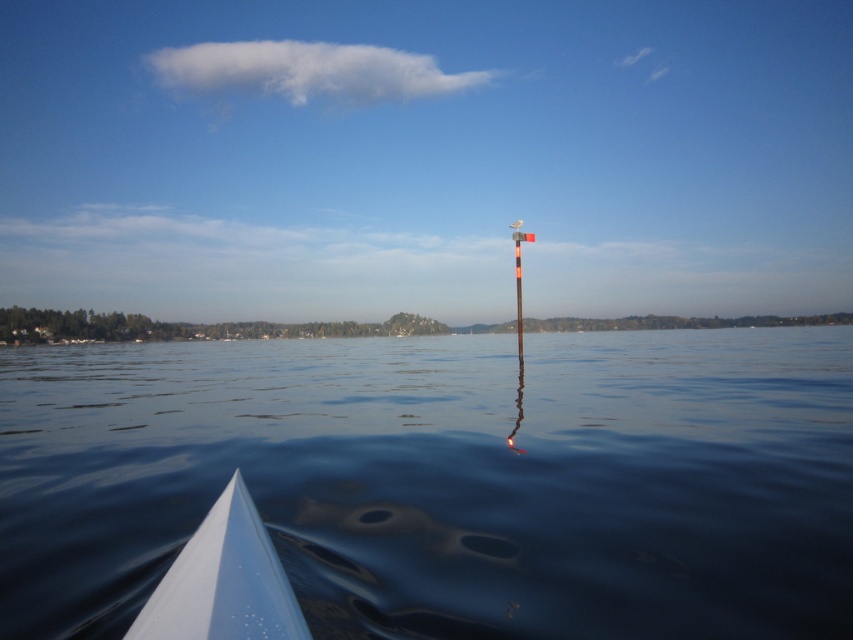
You are a boater navigating a serene water scene. You see a point at coordinates (445, 480). What is the location of this point relative to the transparent water at center?

The point at (445, 480) is located on the transparent water at center.

You are a kayaker planning to navigate through the area shown. You see the transparent water at center and the white glossy boat at lower left. Which path should you choose to ensure your kayak has enough space to pass safely?

The transparent water at center might be wider than the white glossy boat at lower left, so choosing the path through the transparent water at center would provide more space for the kayak to pass safely.